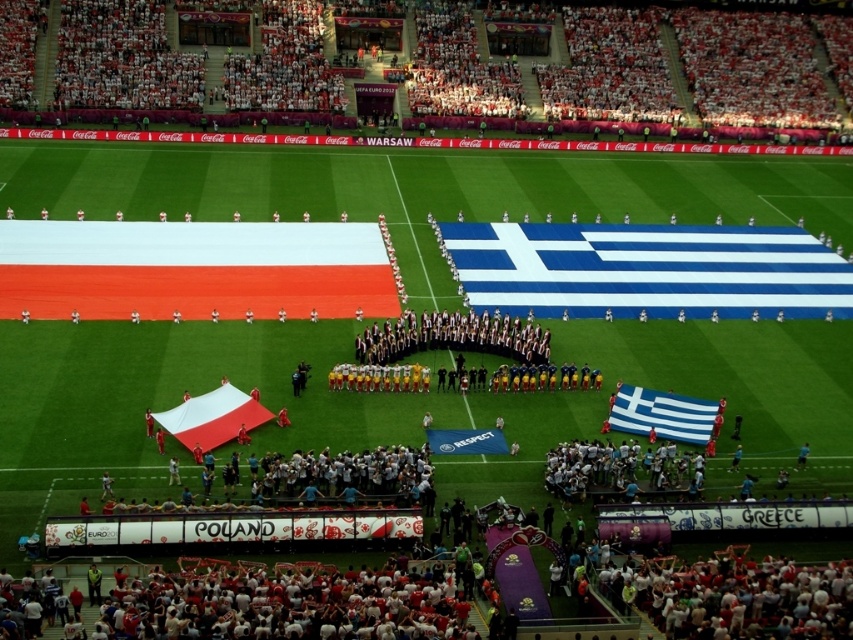
You are a photographer at the UEFA Euro 2012 ceremony. You need to capture a photo that includes both the blue and white fabric flag at lower right and the white matte flag at center. Based on their positions, which flag should be placed on the right side of the photo to ensure both are in frame?

The blue and white fabric flag at lower right is already positioned to the right of the white matte flag at center, so placing it on the right side of the photo will ensure both are in frame.

You are a photographer positioned at the edge of the field. You want to take a photo that includes both the blue and white fabric flag at lower right and the white matte flag at center. Which flag should you adjust your camera angle to focus on first to ensure both are in frame?

You should focus on the blue and white fabric flag at lower right first because it is closer to you than the white matte flag at center, so adjusting your angle to include it will naturally bring the farther flag into view.